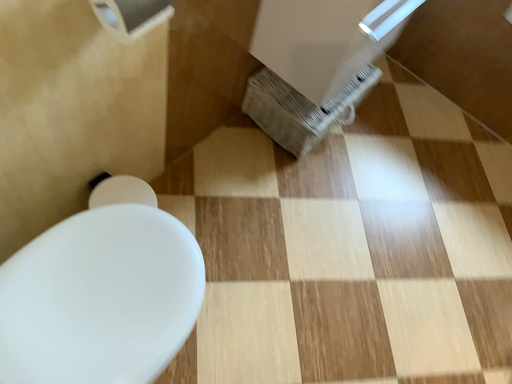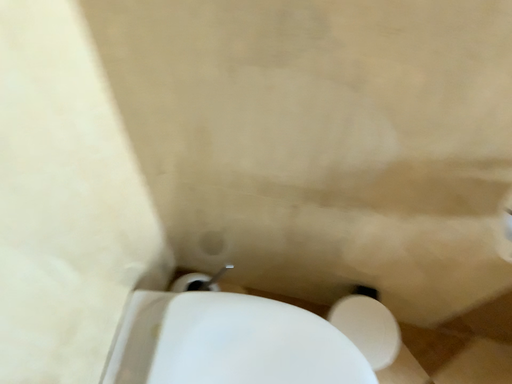
Question: How did the camera likely rotate when shooting the video?

Choices:
 (A) rotated right
 (B) rotated left

Answer: (B)